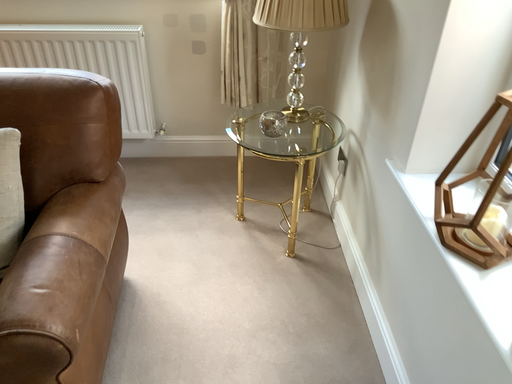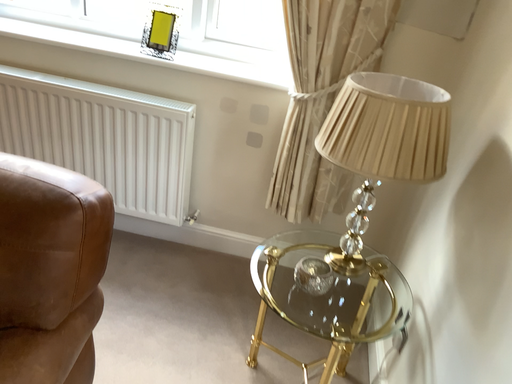
Question: Which way did the camera rotate in the video?

Choices:
 (A) rotated upward
 (B) rotated downward

Answer: (A)